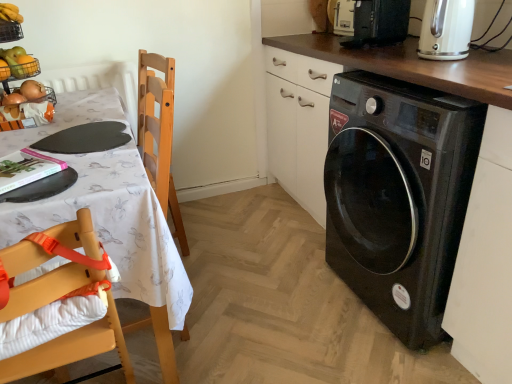
Question: From a real-world perspective, is wooden highchair at left located beneath black glossy washing machine at lower right?

Choices:
 (A) no
 (B) yes

Answer: (A)

Question: From the image's perspective, is wooden highchair at left under black glossy washing machine at lower right?

Choices:
 (A) no
 (B) yes

Answer: (B)

Question: Can you confirm if wooden highchair at left is taller than black glossy washing machine at lower right?

Choices:
 (A) yes
 (B) no

Answer: (B)

Question: Is wooden highchair at left oriented towards black glossy washing machine at lower right?

Choices:
 (A) no
 (B) yes

Answer: (A)

Question: Is wooden highchair at left thinner than black glossy washing machine at lower right?

Choices:
 (A) yes
 (B) no

Answer: (A)

Question: Visually, is white fabric tablecloth at left positioned to the left or to the right of black glossy washing machine at lower right?

Choices:
 (A) right
 (B) left

Answer: (B)

Question: Is white fabric tablecloth at left taller or shorter than black glossy washing machine at lower right?

Choices:
 (A) short
 (B) tall

Answer: (A)

Question: Considering the positions of point (99, 97) and point (345, 175), is point (99, 97) closer or farther from the camera than point (345, 175)?

Choices:
 (A) farther
 (B) closer

Answer: (A)

Question: Based on their sizes in the image, would you say white fabric tablecloth at left is bigger or smaller than black glossy washing machine at lower right?

Choices:
 (A) big
 (B) small

Answer: (A)

Question: Considering the positions of black glossy washing machine at lower right and cream matte electric kettle at upper right in the image, is black glossy washing machine at lower right bigger or smaller than cream matte electric kettle at upper right?

Choices:
 (A) small
 (B) big

Answer: (B)

Question: Is black glossy washing machine at lower right in front of or behind cream matte electric kettle at upper right in the image?

Choices:
 (A) behind
 (B) front

Answer: (B)

Question: From their relative heights in the image, would you say black glossy washing machine at lower right is taller or shorter than cream matte electric kettle at upper right?

Choices:
 (A) short
 (B) tall

Answer: (B)

Question: Is black glossy washing machine at lower right to the left or to the right of cream matte electric kettle at upper right in the image?

Choices:
 (A) right
 (B) left

Answer: (A)

Question: Choose the correct answer: Is white fabric tablecloth at left inside wooden highchair at left or outside it?

Choices:
 (A) inside
 (B) outside

Answer: (B)

Question: From a real-world perspective, is white fabric tablecloth at left above or below wooden highchair at left?

Choices:
 (A) above
 (B) below

Answer: (B)